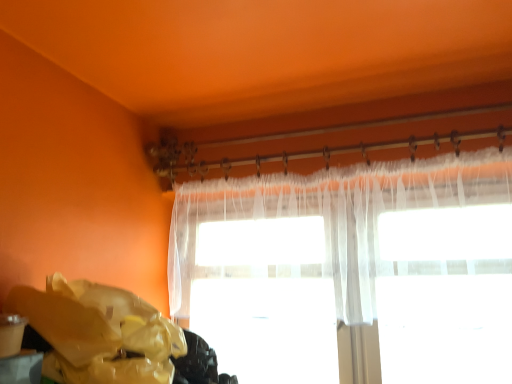
Question: Is point (384, 246) closer or farther from the camera than point (93, 375)?

Choices:
 (A) farther
 (B) closer

Answer: (A)

Question: Is sheer white curtain at upper center bigger or smaller than yellow plastic bag at lower left?

Choices:
 (A) big
 (B) small

Answer: (A)

Question: From the image's perspective, is sheer white curtain at upper center positioned above or below yellow plastic bag at lower left?

Choices:
 (A) below
 (B) above

Answer: (B)

Question: From the image's perspective, relative to sheer white curtain at upper center, is yellow plastic bag at lower left above or below?

Choices:
 (A) above
 (B) below

Answer: (B)

Question: Relative to sheer white curtain at upper center, is yellow plastic bag at lower left in front or behind?

Choices:
 (A) front
 (B) behind

Answer: (A)

Question: From their relative heights in the image, would you say yellow plastic bag at lower left is taller or shorter than sheer white curtain at upper center?

Choices:
 (A) short
 (B) tall

Answer: (A)

Question: Based on their sizes in the image, would you say yellow plastic bag at lower left is bigger or smaller than sheer white curtain at upper center?

Choices:
 (A) big
 (B) small

Answer: (B)